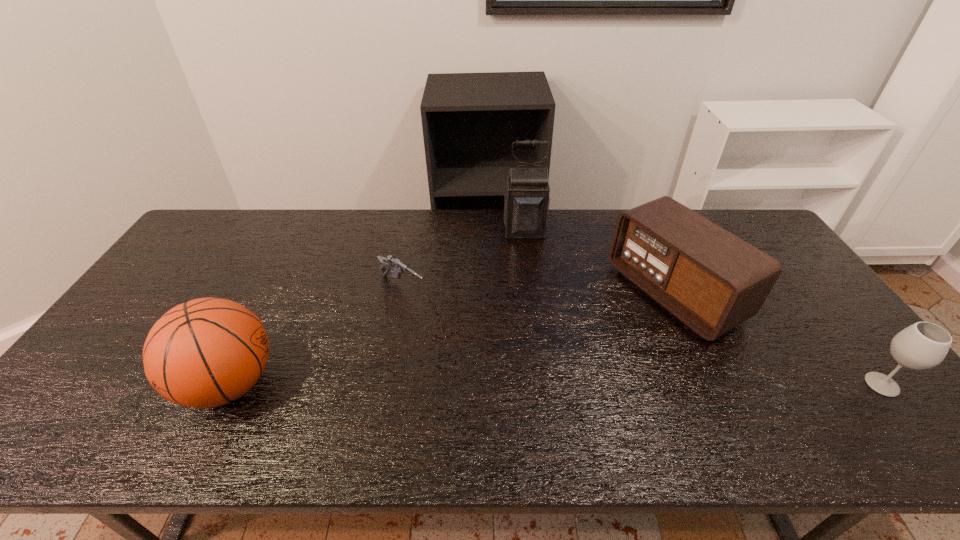
This screenshot has height=540, width=960. What are the coordinates of `basketball present at the near edge` in the screenshot? It's located at (204, 353).

The image size is (960, 540). What are the coordinates of `wineglass at the near edge` in the screenshot? It's located at (923, 345).

At what (x,y) coordinates should I click in order to perform the action: click on object located at the right edge. Please return your answer as a coordinate pair (x, y). This screenshot has height=540, width=960. Looking at the image, I should click on (923, 345).

This screenshot has width=960, height=540. I want to click on object located at the near right corner, so click(923, 345).

Where is `vacant area at the far edge`? Image resolution: width=960 pixels, height=540 pixels. vacant area at the far edge is located at coordinates (482, 211).

This screenshot has width=960, height=540. Identify the location of free space at the left edge of the desktop. (115, 358).

The image size is (960, 540). I want to click on vacant area at the right edge, so click(823, 334).

Where is `free area in between the second object from left to right and the second object from right to left`? free area in between the second object from left to right and the second object from right to left is located at coordinates (538, 289).

This screenshot has width=960, height=540. Find the location of `free area in between the fourth object from left to right and the rightmost object`. free area in between the fourth object from left to right and the rightmost object is located at coordinates (778, 339).

You are a GUI agent. You are given a task and a screenshot of the screen. Output one action in this format:
    pyautogui.click(x=<x>, y=<y>)
    Task: Click on the free space between the leftmost object and the radio receiver
    
    Given the screenshot: What is the action you would take?
    pyautogui.click(x=452, y=338)